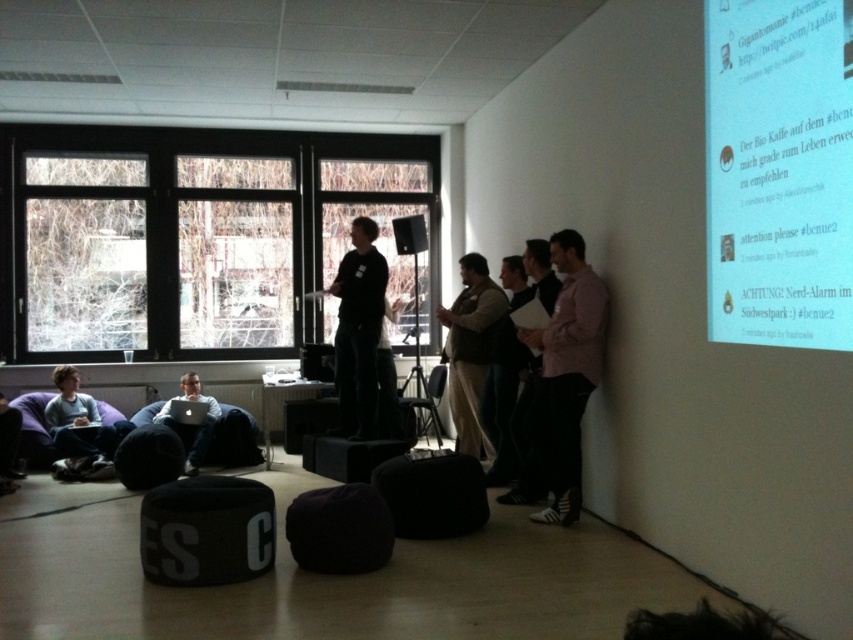
You are an attendee at a workshop and need to locate the white paper at upper right and the pink matte shirt at right. Based on the scene, which object is positioned higher?

The white paper at upper right is positioned higher than the pink matte shirt at right.

You are organizing a workshop in this room and need to place a new poster on the wall. The poster is meant to be seen by people sitting on the light blue fabric bean bag at lower left. Where should you place the poster relative to the white paper at upper right to ensure it is visible from the bean bag?

The poster should be placed below the white paper at upper right so that it is at eye level for people sitting on the light blue fabric bean bag at lower left. Since the white paper at upper right is above the light blue fabric bean bag at lower left, placing the poster below it would make it more visible from the bean bag.

You are organizing a workshop and need to place a new poster on the wall. The poster is 1 meter wide. You want to ensure it can be seen clearly by everyone sitting on the light blue fabric bean bag at lower left and the white paper at upper right. Based on their positions, is the poster likely to be visible to both areas?

The white paper at upper right is in front of the light blue fabric bean bag at lower left. Since the poster is placed on the wall, if it is 1 meter wide and positioned centrally, it should be visible to both areas as they are aligned along the same wall.